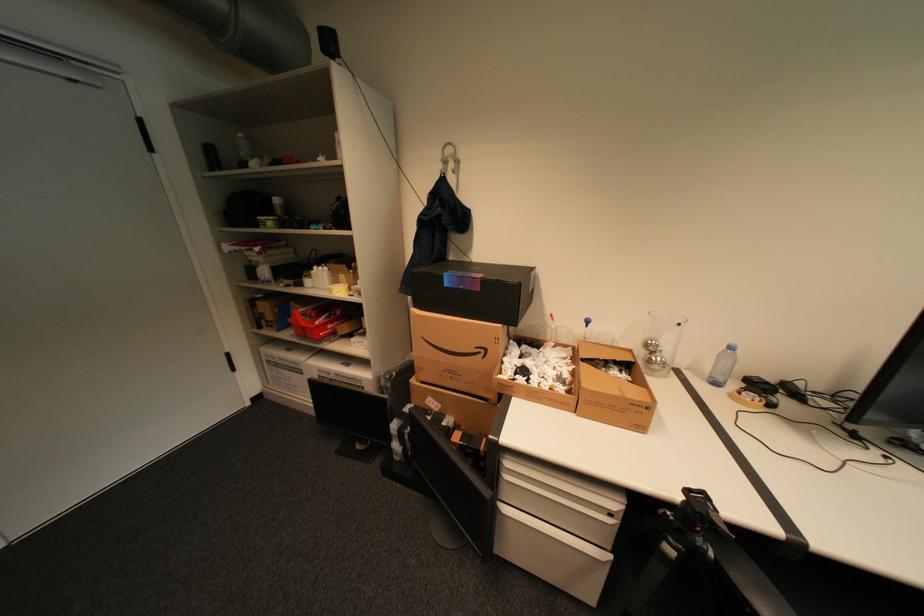
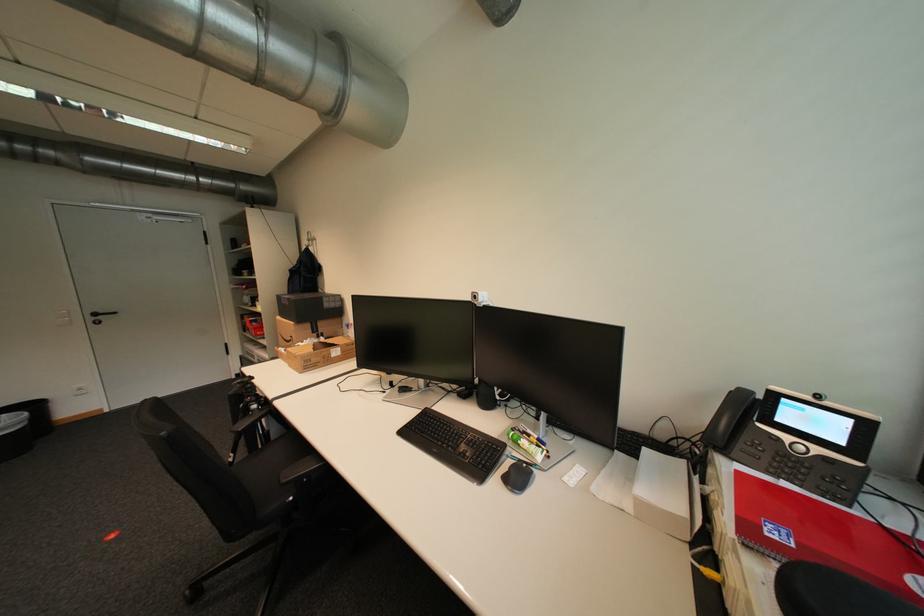
Locate, in the second image, the point that corresponds to (x=257, y=405) in the first image.

(242, 378)